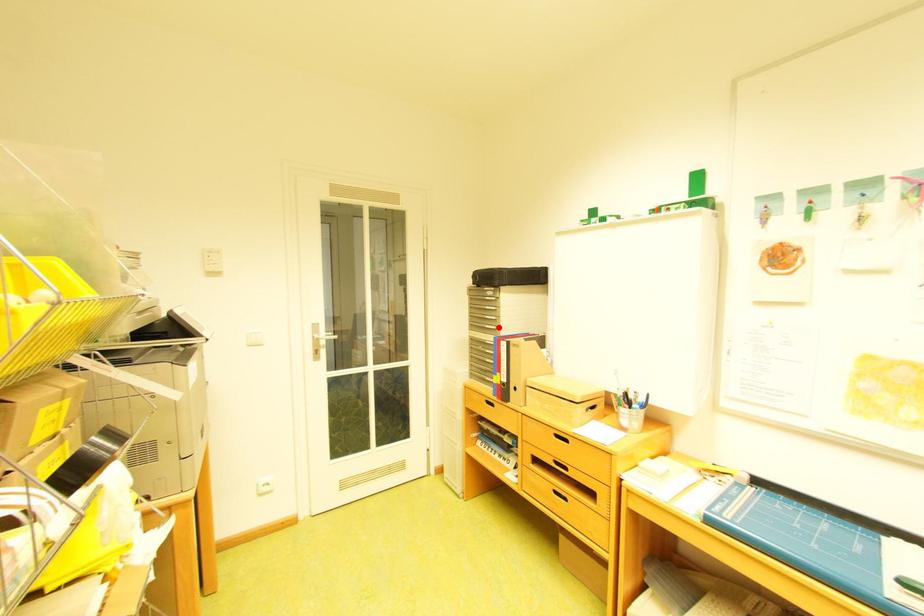
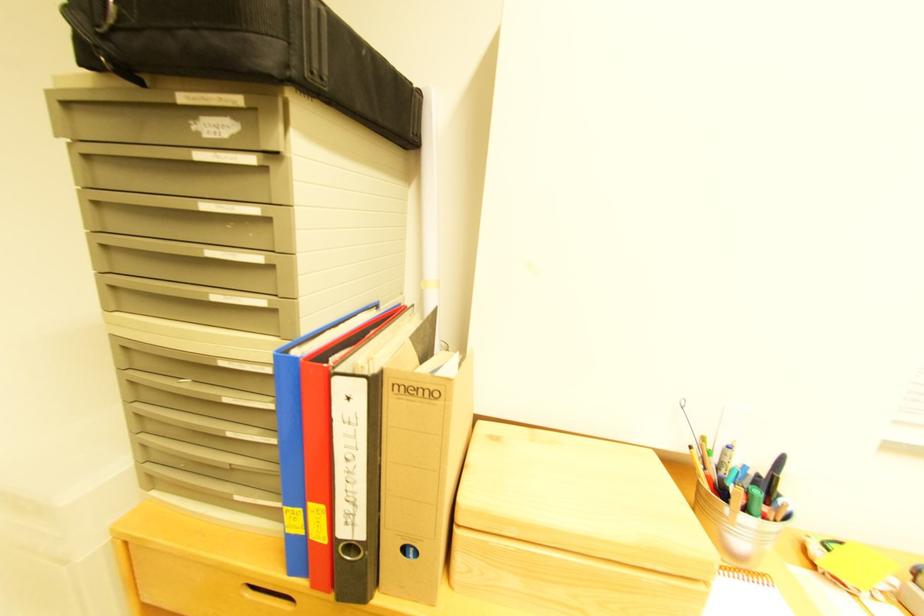
In the second image, find the point that corresponds to the highlighted location in the first image.

(228, 298)